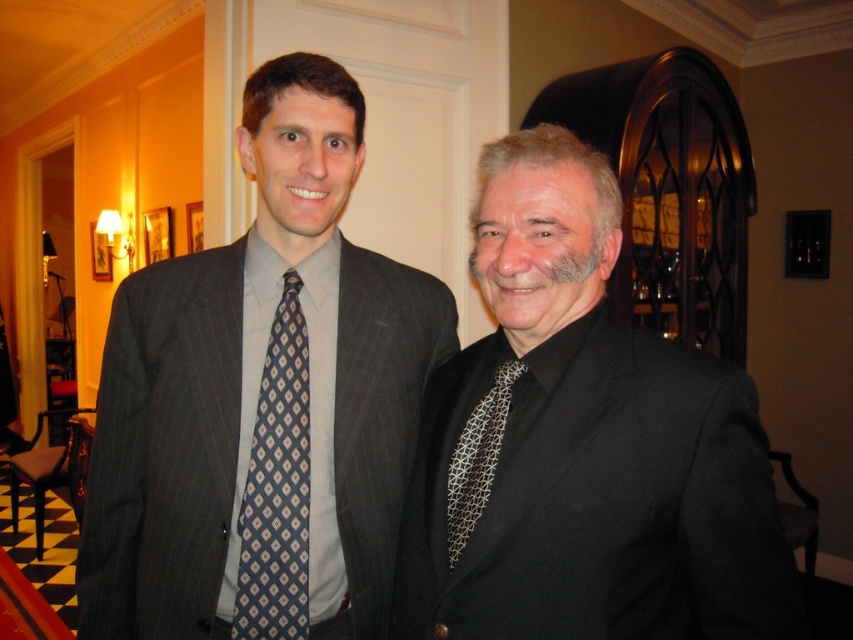
Please look at the scene and find the object named matte gray suit at center. What are its coordinates in the image?

The coordinates of the matte gray suit at center are at point (262,403).

You are standing at the camera position and want to place a 4.0 feet long banner between you and the point at point (341, 374). Will the banner fit in the space available?

The distance between the camera and point (341, 374) is 3.80 feet, which is shorter than the banner length of 4.0 feet. Therefore, the banner will not fit in the available space.